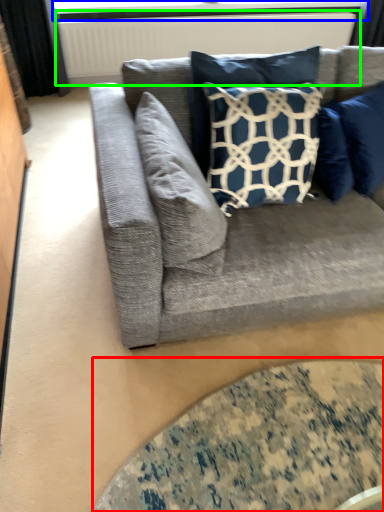
Question: Which object is the farthest from glass table (highlighted by a red box)? Choose among these: window screen (highlighted by a blue box) or radiator (highlighted by a green box).

Choices:
 (A) window screen
 (B) radiator

Answer: (A)